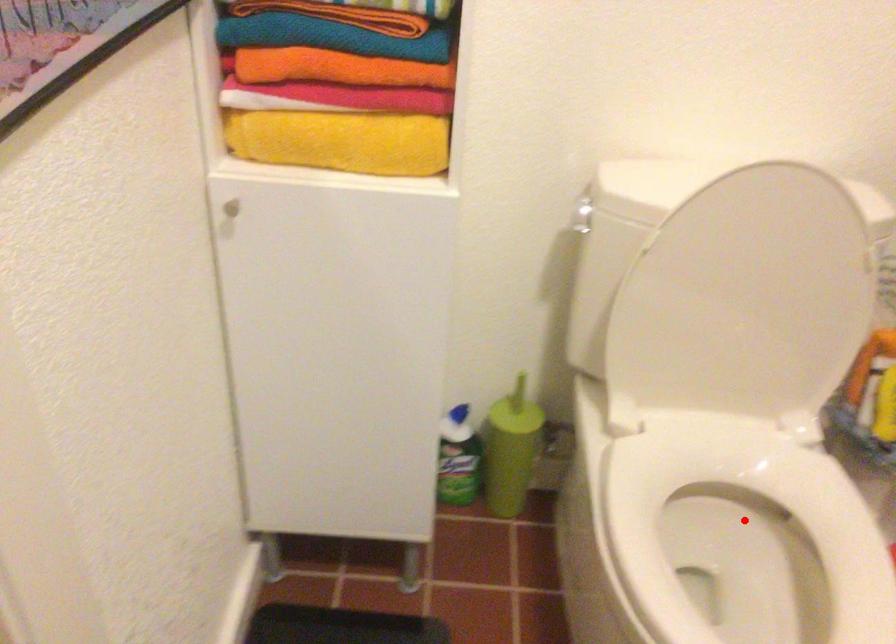
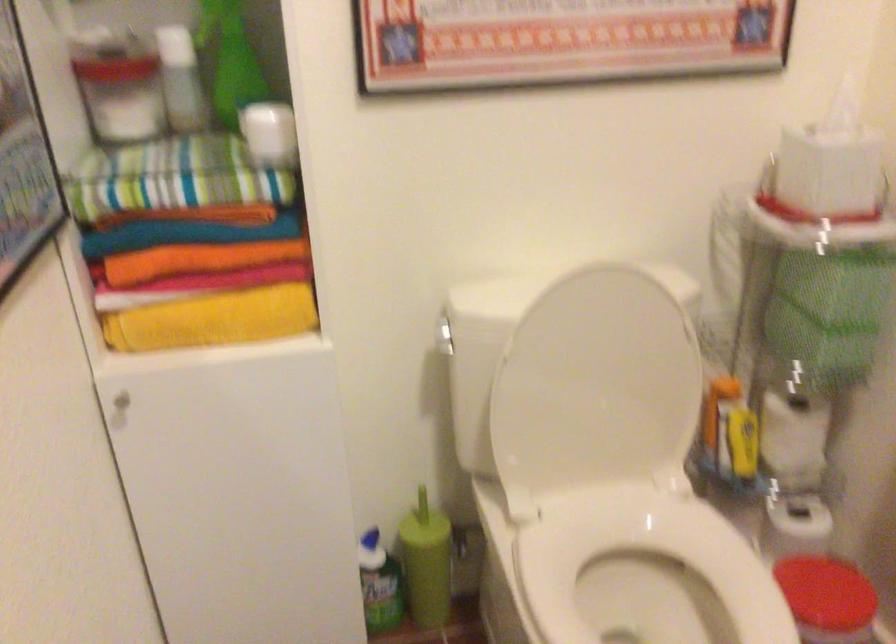
The point at the highlighted location is marked in the first image. Where is the corresponding point in the second image?

(648, 578)